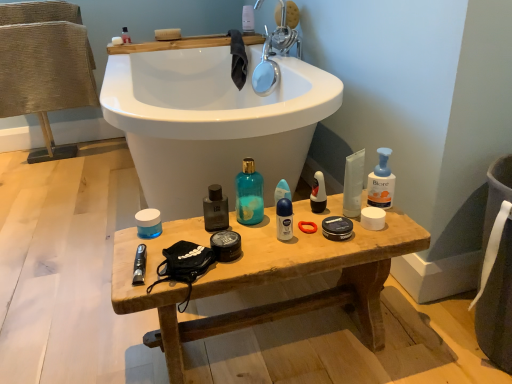
Where is `vacant space in front of white matte deodorant at center, the third toiletry in the right-to-left sequence`? vacant space in front of white matte deodorant at center, the third toiletry in the right-to-left sequence is located at coordinates (282, 253).